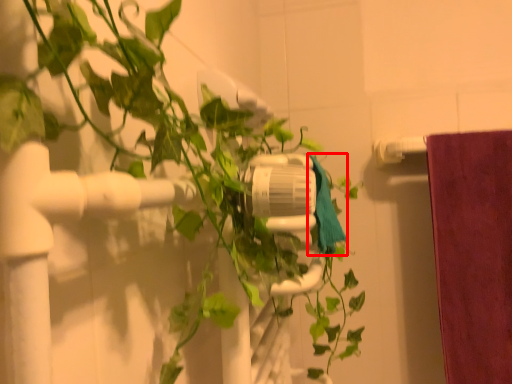
Question: In this image, where is bath towel (annotated by the red box) located relative to houseplant?

Choices:
 (A) right
 (B) left

Answer: (A)